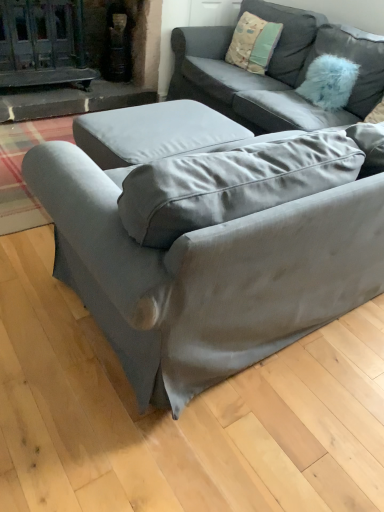
Question: Considering the relative positions of textured cotton pillow at upper right, acting as the second pillow starting from the right, and satin gray couch at center, acting as the first studio couch starting from the back, in the image provided, is textured cotton pillow at upper right, acting as the second pillow starting from the right, to the left or to the right of satin gray couch at center, acting as the first studio couch starting from the back,?

Choices:
 (A) right
 (B) left

Answer: (B)

Question: Choose the correct answer: Is textured cotton pillow at upper right, acting as the 1th pillow starting from the left, inside satin gray couch at center, acting as the first studio couch starting from the back, or outside it?

Choices:
 (A) outside
 (B) inside

Answer: (B)

Question: Which is farther from the satin gray couch at center, the 1th studio couch in the front-to-back sequence?

Choices:
 (A) textured cotton pillow at upper right, acting as the 1th pillow starting from the left
 (B) fuzzy blue pillow at upper right, placed as the 2th pillow when sorted from left to right
 (C) satin gray couch at center, acting as the first studio couch starting from the back

Answer: (A)

Question: Which of these objects is positioned closest to the satin gray couch at center, the 1th studio couch in the front-to-back sequence?

Choices:
 (A) textured cotton pillow at upper right, acting as the second pillow starting from the right
 (B) fuzzy blue pillow at upper right, placed as the 2th pillow when sorted from left to right
 (C) satin gray couch at center, the second studio couch in the front-to-back sequence

Answer: (C)